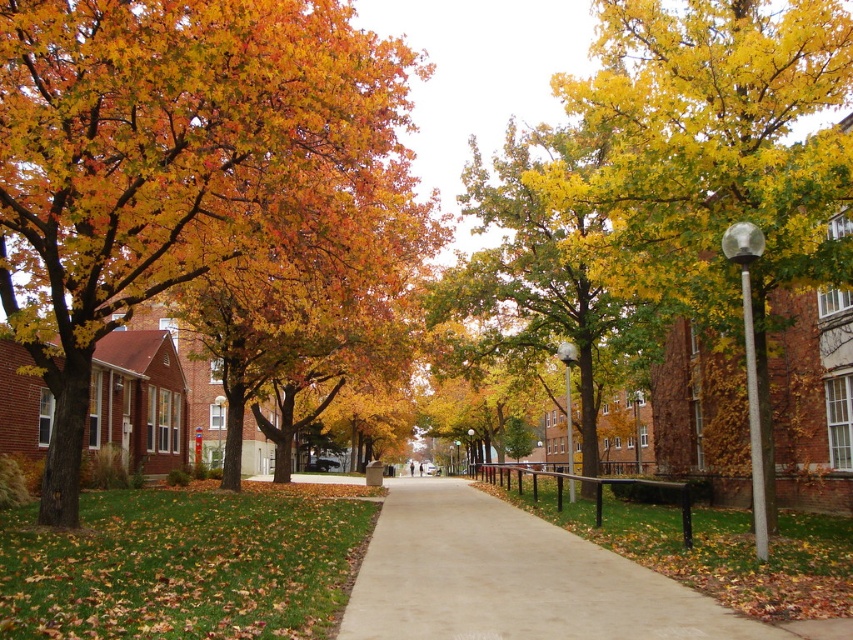
Question: Which point is farther to the camera?

Choices:
 (A) (492, 536)
 (B) (461, 269)
 (C) (653, 58)
 (D) (198, 200)

Answer: (B)

Question: Which of the following is the closest to the observer?

Choices:
 (A) (668, 74)
 (B) (555, 253)
 (C) (577, 632)

Answer: (C)

Question: Which point appears closest to the camera in this image?

Choices:
 (A) (108, 147)
 (B) (757, 538)
 (C) (508, 192)

Answer: (B)

Question: Is orange leafy tree at left positioned at the back of yellow/golden leaves at center?

Choices:
 (A) yes
 (B) no

Answer: (B)

Question: Is orange leafy tree at left to the right of yellow/golden leaves at center from the viewer's perspective?

Choices:
 (A) no
 (B) yes

Answer: (A)

Question: In this image, where is orange leafy tree at left located relative to smooth concrete sidewalk at center?

Choices:
 (A) right
 (B) left

Answer: (B)